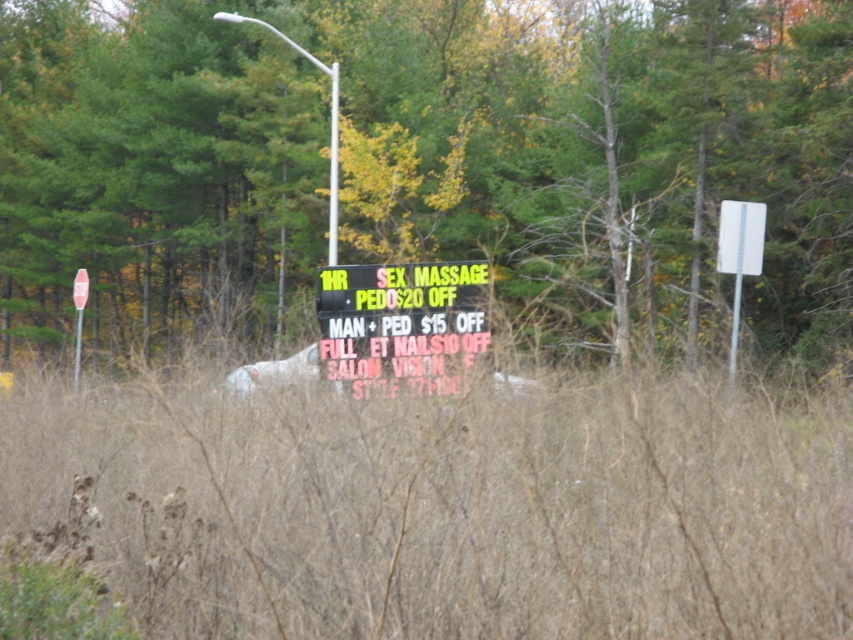
Question: Which is farther from the green leafy tree at center?

Choices:
 (A) black plastic sign at center
 (B) brown dry grass at center

Answer: (B)

Question: Can you confirm if green leafy tree at center is positioned to the left of black plastic sign at center?

Choices:
 (A) yes
 (B) no

Answer: (A)

Question: Based on their relative distances, which object is farther from the black plastic sign at center?

Choices:
 (A) green leafy tree at center
 (B) brown dry grass at center

Answer: (A)

Question: Among these points, which one is farthest from the camera?

Choices:
 (A) (792, 512)
 (B) (323, 273)

Answer: (B)

Question: Does green leafy tree at center appear under brown dry grass at center?

Choices:
 (A) no
 (B) yes

Answer: (A)

Question: Is brown dry grass at center wider than black plastic sign at center?

Choices:
 (A) yes
 (B) no

Answer: (A)